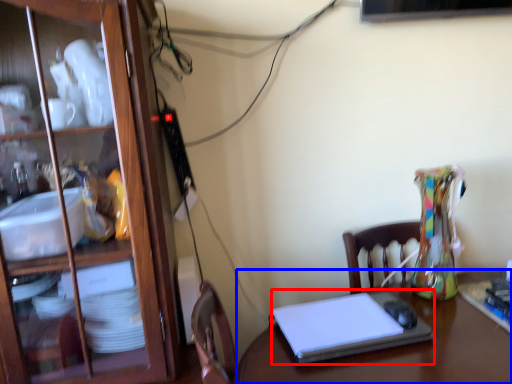
Question: Which object is closer to the camera taking this photo, laptop (highlighted by a red box) or desk (highlighted by a blue box)?

Choices:
 (A) laptop
 (B) desk

Answer: (B)